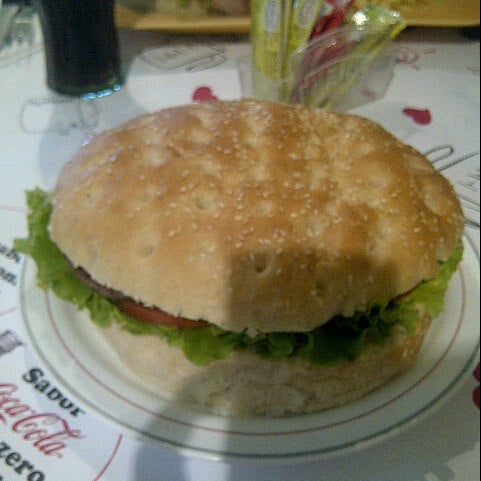
This screenshot has height=481, width=481. Find the location of `white and red striped plate`. white and red striped plate is located at coordinates (357, 422).